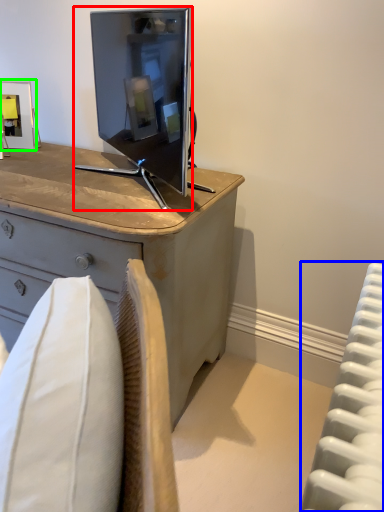
Question: Based on their relative distances, which object is farther from television (highlighted by a red box)? Choose from radiator (highlighted by a blue box) and picture frame (highlighted by a green box).

Choices:
 (A) radiator
 (B) picture frame

Answer: (A)